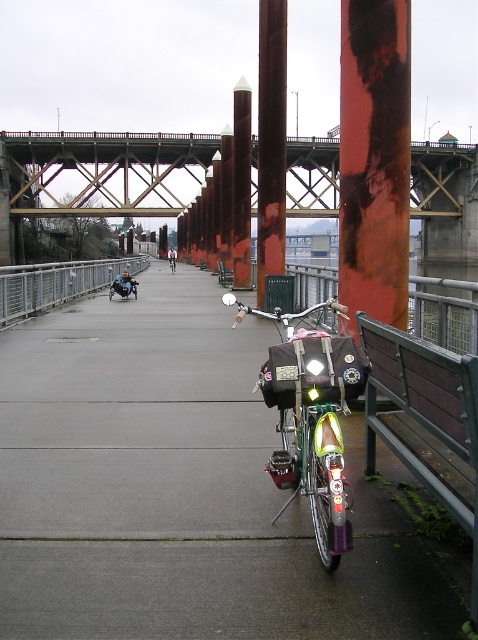
Question: Is rusty metal bridge at upper center closer to camera compared to brown wooden bench at lower right?

Choices:
 (A) no
 (B) yes

Answer: (A)

Question: Is metallic gray rail at left to the right of brown wooden bench at center from the viewer's perspective?

Choices:
 (A) yes
 (B) no

Answer: (B)

Question: From the image, what is the correct spatial relationship of shiny metallic bicycle at center in relation to metallic gray rail at left?

Choices:
 (A) right
 (B) left

Answer: (A)

Question: Among these objects, which one is farthest from the camera?

Choices:
 (A) brown wooden bench at lower right
 (B) concrete at center
 (C) shiny black motorcycle at center
 (D) rusty metal bridge at upper center

Answer: (C)

Question: Which point is closer to the camera taking this photo?

Choices:
 (A) (337, 481)
 (B) (165, 518)
 (C) (35, 308)
 (D) (283, 134)

Answer: (A)

Question: Among these objects, which one is nearest to the camera?

Choices:
 (A) brown wooden bench at lower right
 (B) metallic gray rail at left
 (C) concrete at center

Answer: (A)